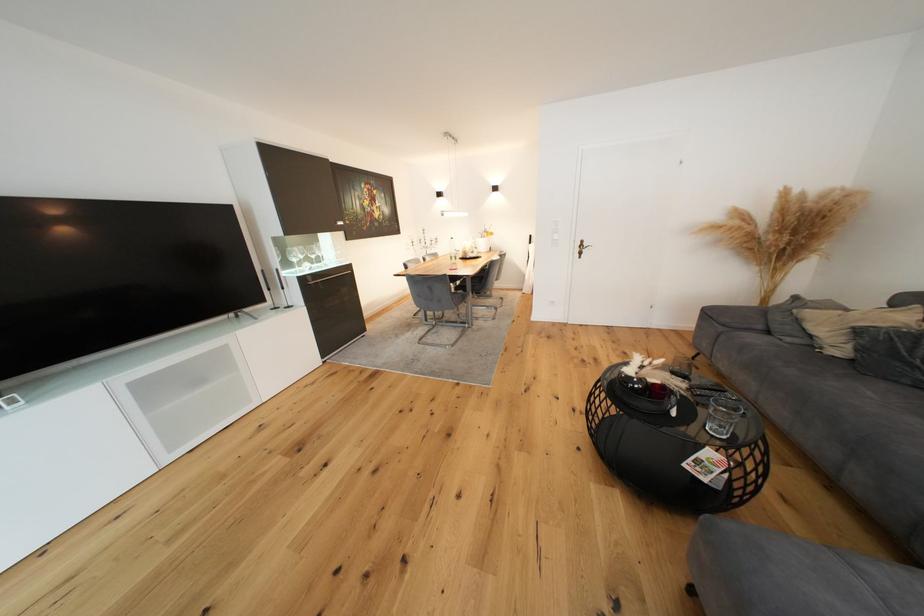
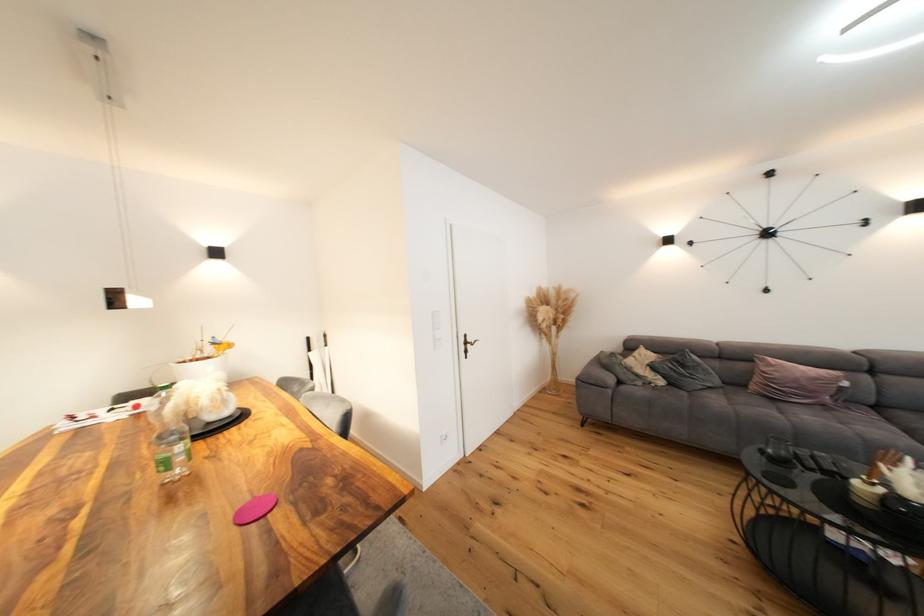
Locate, in the second image, the point that corresponds to point 805,323 in the first image.

(637, 371)